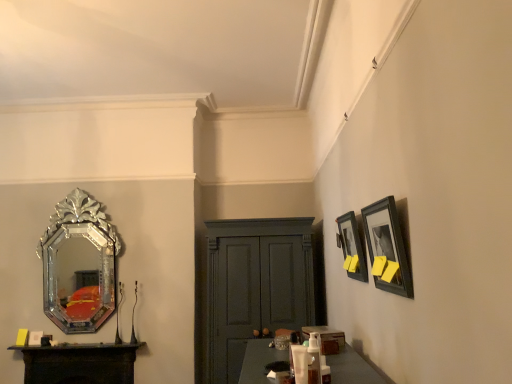
Question: Does black matte picture frame at upper right, the second picture frame from the back, have a larger size compared to silver/glass mirror at left?

Choices:
 (A) no
 (B) yes

Answer: (A)

Question: Can we say black matte picture frame at upper right, arranged as the 1th picture frame when viewed from the front, lies outside silver/glass mirror at left?

Choices:
 (A) no
 (B) yes

Answer: (B)

Question: Is black matte picture frame at upper right, the second picture frame from the back, wider than silver/glass mirror at left?

Choices:
 (A) no
 (B) yes

Answer: (A)

Question: From a real-world perspective, is black matte picture frame at upper right, arranged as the 1th picture frame when viewed from the front, on silver/glass mirror at left?

Choices:
 (A) no
 (B) yes

Answer: (A)

Question: Considering the relative positions of black matte picture frame at upper right, arranged as the 1th picture frame when viewed from the front, and silver/glass mirror at left in the image provided, is black matte picture frame at upper right, arranged as the 1th picture frame when viewed from the front, to the left of silver/glass mirror at left from the viewer's perspective?

Choices:
 (A) no
 (B) yes

Answer: (A)

Question: Is translucent plastic bottle at center, the first toiletry from the left, spatially inside black matte picture frame at upper right, arranged as the 1th picture frame when viewed from the front, or outside of it?

Choices:
 (A) outside
 (B) inside

Answer: (A)

Question: Looking at their shapes, would you say translucent plastic bottle at center, the second toiletry when ordered from front to back, is wider or thinner than black matte picture frame at upper right, the second picture frame from the back?

Choices:
 (A) thin
 (B) wide

Answer: (A)

Question: From a real-world perspective, is translucent plastic bottle at center, which is counted as the 1th toiletry, starting from the back, physically located above or below black matte picture frame at upper right, arranged as the 1th picture frame when viewed from the front?

Choices:
 (A) below
 (B) above

Answer: (A)

Question: In terms of height, does translucent plastic bottle at center, the second toiletry positioned from the right, look taller or shorter compared to black matte picture frame at upper right, arranged as the 1th picture frame when viewed from the front?

Choices:
 (A) short
 (B) tall

Answer: (A)

Question: In terms of size, does matte black picture frame at upper right, marked as the first picture frame in a back-to-front arrangement, appear bigger or smaller than translucent plastic bottle at center, the first toiletry from the left?

Choices:
 (A) small
 (B) big

Answer: (B)

Question: Would you say matte black picture frame at upper right, marked as the first picture frame in a back-to-front arrangement, is inside or outside translucent plastic bottle at center, the second toiletry positioned from the right?

Choices:
 (A) inside
 (B) outside

Answer: (B)

Question: In terms of width, does matte black picture frame at upper right, the second picture frame viewed from the front, look wider or thinner when compared to translucent plastic bottle at center, which is counted as the 1th toiletry, starting from the back?

Choices:
 (A) thin
 (B) wide

Answer: (B)

Question: In terms of height, does matte black picture frame at upper right, marked as the first picture frame in a back-to-front arrangement, look taller or shorter compared to translucent plastic bottle at center, the first toiletry from the left?

Choices:
 (A) short
 (B) tall

Answer: (B)

Question: Is silver/glass mirror at left wider or thinner than dark wood table at lower left?

Choices:
 (A) wide
 (B) thin

Answer: (B)

Question: Which is correct: silver/glass mirror at left is inside dark wood table at lower left, or outside of it?

Choices:
 (A) inside
 (B) outside

Answer: (B)